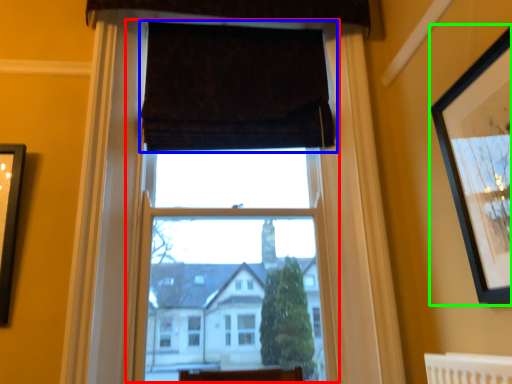
Question: Considering the real-world distances, which object is closest to window frame (highlighted by a red box)? curtain (highlighted by a blue box) or picture frame (highlighted by a green box).

Choices:
 (A) curtain
 (B) picture frame

Answer: (A)